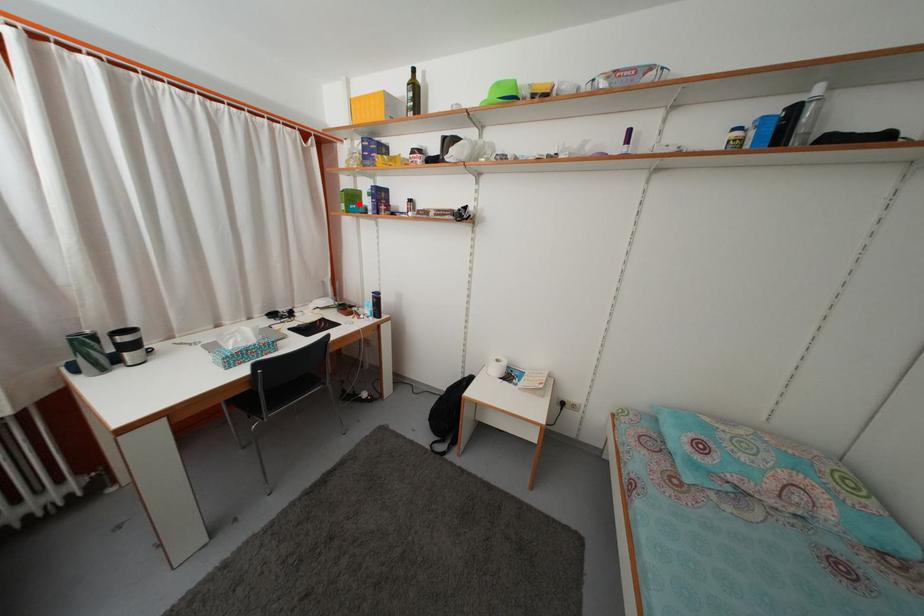
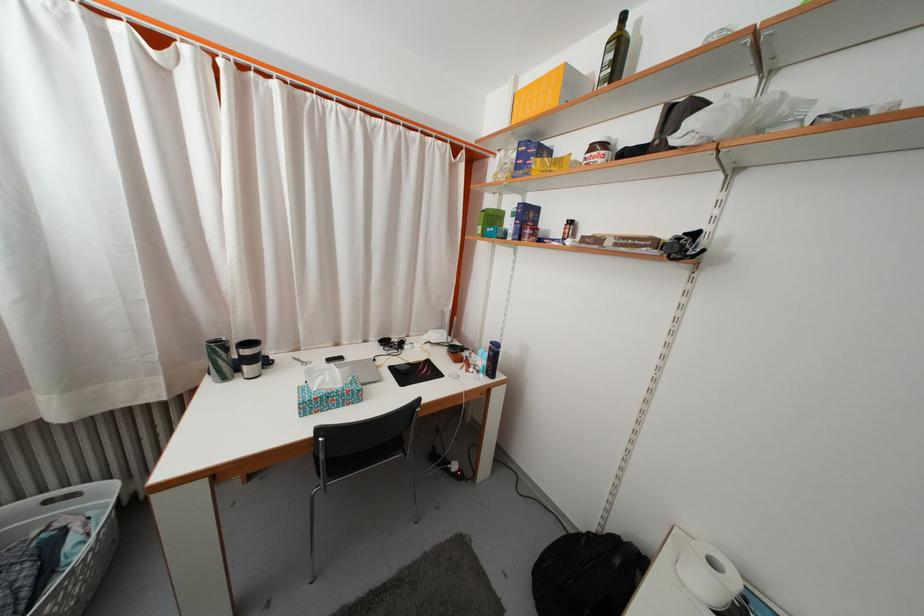
The point at the highlighted location is marked in the first image. Where is the corresponding point in the second image?

(500, 225)